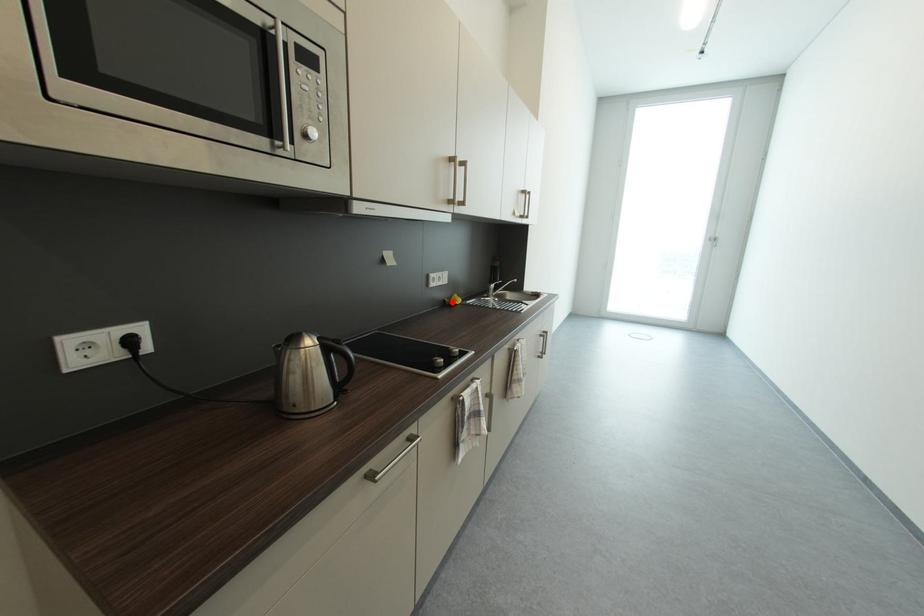
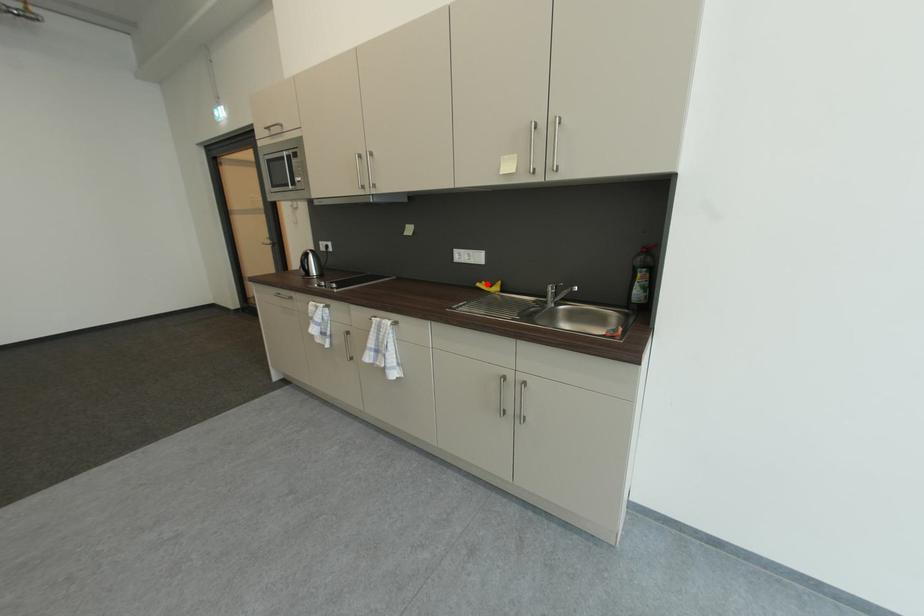
I am providing you with two images of the same scene from different viewpoints. A red point is marked on the first image and another point is marked on the second image. Is the red point in image1 aligned with the point shown in image2?

Yes